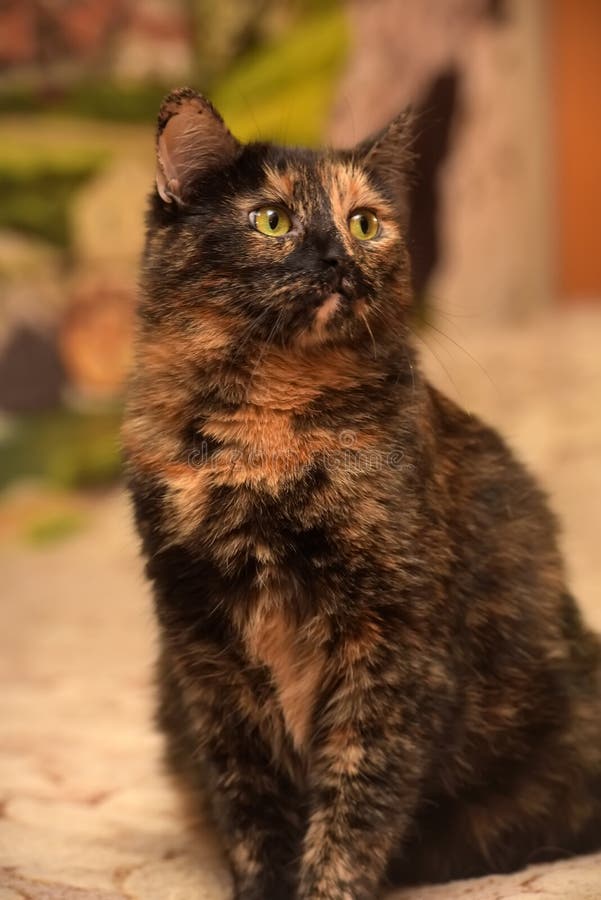
Locate an element on the screen. cinnamon chest is located at coordinates (291, 687).